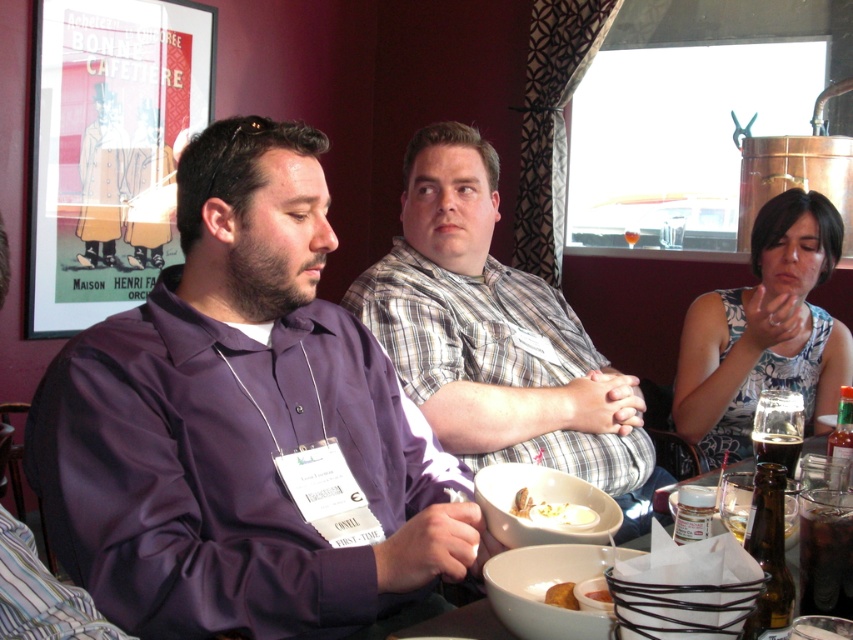
At what (x,y) coordinates should I click in order to perform the action: click on white creamy bowl at lower center. Please return your answer as a coordinate pair (x, y). Image resolution: width=853 pixels, height=640 pixels. Looking at the image, I should click on (553, 513).

Can you confirm if white creamy bowl at lower center is positioned below brown glass bottle at lower right?

Yes.

Between point (518, 497) and point (757, 433), which one is positioned behind?

Positioned behind is point (757, 433).

You are a GUI agent. You are given a task and a screenshot of the screen. Output one action in this format:
    pyautogui.click(x=<x>, y=<y>)
    Task: Click on the white creamy bowl at lower center
    Image resolution: width=853 pixels, height=640 pixels.
    Given the screenshot: What is the action you would take?
    pyautogui.click(x=553, y=513)

Is purple smooth shirt at center closer to camera compared to purple satin shirt at center?

No, purple smooth shirt at center is behind purple satin shirt at center.

Is purple smooth shirt at center below purple satin shirt at center?

No, purple smooth shirt at center is not below purple satin shirt at center.

Locate an element on the screen. The width and height of the screenshot is (853, 640). purple smooth shirt at center is located at coordinates (241, 424).

Where is `purple smooth shirt at center`? The image size is (853, 640). purple smooth shirt at center is located at coordinates (241, 424).

Is point (540, 509) farther from camera compared to point (560, 596)?

Yes.

Which is more to the left, white creamy bowl at lower center or yellow matte bread at lower center?

Positioned to the left is yellow matte bread at lower center.

Where is `white creamy bowl at lower center`? The width and height of the screenshot is (853, 640). white creamy bowl at lower center is located at coordinates (553, 513).

The image size is (853, 640). I want to click on white creamy bowl at lower center, so click(553, 513).